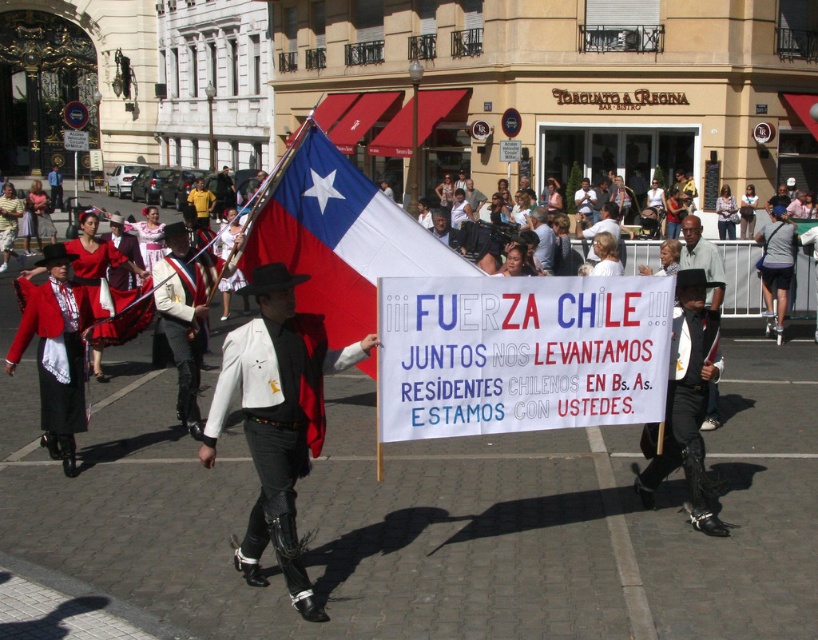
You are standing in the middle of the street looking at the vibrant parade scene. There are two points marked in the image. The first point is at coordinate point (708, 269) and the second point is at coordinate point (3, 216). Which point is closer to you?

Point (708, 269) is closer to the viewer than point (3, 216).

You are a photographer standing in the middle of the street, and you want to capture a photo that includes both the matte black cowboy hat at center and the red satin dress at center. Which object should you focus on first to ensure both are in the frame?

The matte black cowboy hat at center is located below the red satin dress at center, so you should focus on the red satin dress at center first to ensure both are in the frame.